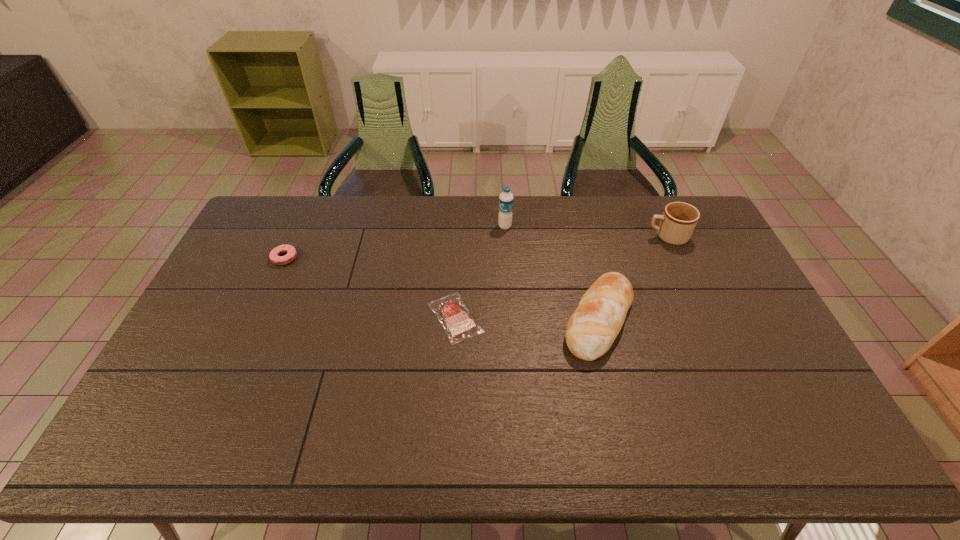
Identify the location of object that is at the right edge. (679, 219).

Find the location of `object that is at the far right corner`. object that is at the far right corner is located at coordinates point(679,219).

Locate an element on the screen. The height and width of the screenshot is (540, 960). free location at the far edge is located at coordinates (607, 197).

In the image, there is a desktop. Find the location of `vacant space at the near edge`. vacant space at the near edge is located at coordinates (202, 429).

Locate an element on the screen. vacant space at the left edge of the desktop is located at coordinates (236, 291).

Where is `blank area at the right edge`? This screenshot has width=960, height=540. blank area at the right edge is located at coordinates (752, 344).

Locate an element on the screen. The image size is (960, 540). free space that is in between the second object from right to left and the tallest object is located at coordinates [x=552, y=273].

This screenshot has height=540, width=960. In order to click on vacant point located between the water bottle and the steak in this screenshot , I will do pyautogui.click(x=480, y=272).

Image resolution: width=960 pixels, height=540 pixels. Identify the location of free point between the mug and the shortest object. (561, 277).

Locate an element on the screen. This screenshot has width=960, height=540. free space between the mug and the second shortest object is located at coordinates click(x=476, y=247).